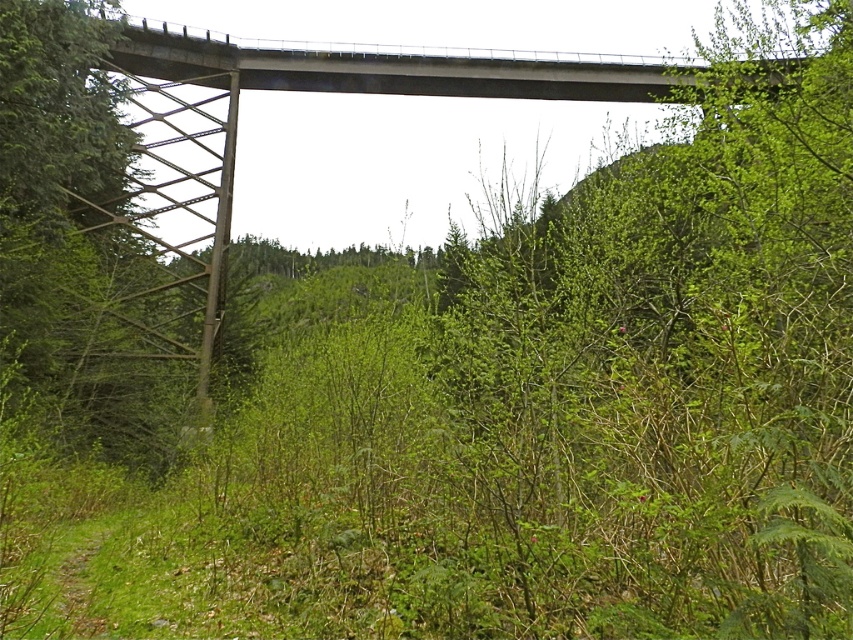
You are standing at the starting point of the path in the image. You want to reach the metallic bridge at center. Which direction should you head towards?

You should head towards the center of the image to reach the metallic bridge at center as it is located at point (310,92).

You are a hiker planning to cross the valley. You see the metallic bridge at center and the concrete bridge at upper center. Which bridge is positioned more to the left side of the image?

The metallic bridge at center is positioned more to the left side of the image compared to the concrete bridge at upper center.

You are a hiker trying to cross the valley. You see two bridges, the metallic bridge at center and the concrete bridge at upper center. Which bridge should you choose to cross if you need a wider path for your group?

The metallic bridge at center is larger in size than the concrete bridge at upper center, so you should choose the metallic bridge at center for a wider path.